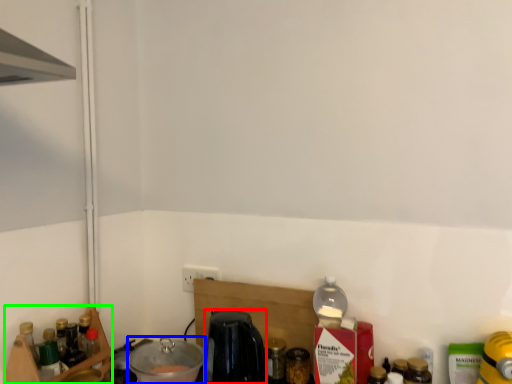
Question: Based on their relative distances, which object is farther from coffee machine (highlighted by a red box)? Choose from appliance (highlighted by a blue box) and shelf (highlighted by a green box).

Choices:
 (A) appliance
 (B) shelf

Answer: (B)